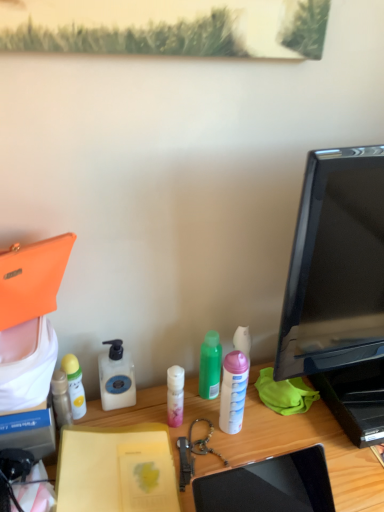
Locate an element on the screen. The height and width of the screenshot is (512, 384). vacant area that lies to the right of translucent plastic bottle at left, the 5th bottle when ordered from right to left is located at coordinates (138, 420).